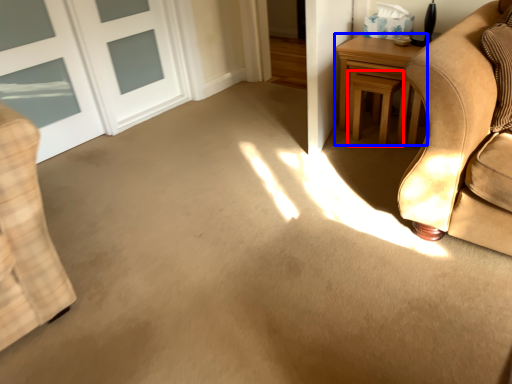
Question: Which of the following is the closest to the observer, stool (highlighted by a red box) or table (highlighted by a blue box)?

Choices:
 (A) stool
 (B) table

Answer: (B)